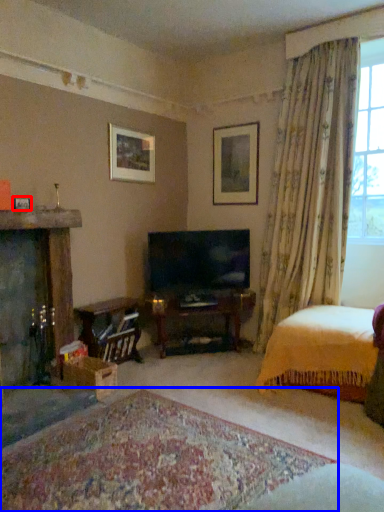
Question: Which point is further to the camera, picture frame (highlighted by a red box) or plain (highlighted by a blue box)?

Choices:
 (A) picture frame
 (B) plain

Answer: (A)